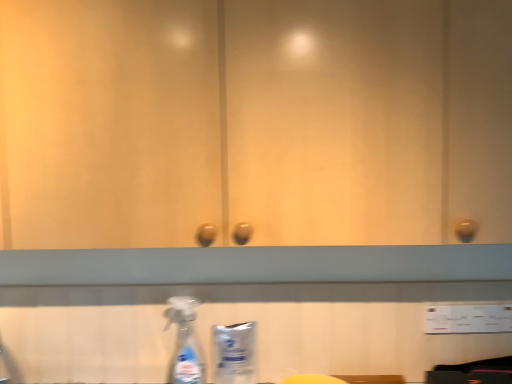
Question: In the image, is white plastic bottle at lower center positioned in front of or behind transparent plastic spray bottle at lower left?

Choices:
 (A) front
 (B) behind

Answer: (B)

Question: Considering the positions of white plastic bottle at lower center and transparent plastic spray bottle at lower left in the image, is white plastic bottle at lower center taller or shorter than transparent plastic spray bottle at lower left?

Choices:
 (A) tall
 (B) short

Answer: (B)

Question: Which of these objects is positioned closest to the white plastic bottle at lower center?

Choices:
 (A) yellow matte sponge at lower center
 (B) transparent plastic spray bottle at lower left

Answer: (B)

Question: Which is nearer to the white plastic bottle at lower center?

Choices:
 (A) yellow matte sponge at lower center
 (B) transparent plastic spray bottle at lower left

Answer: (B)